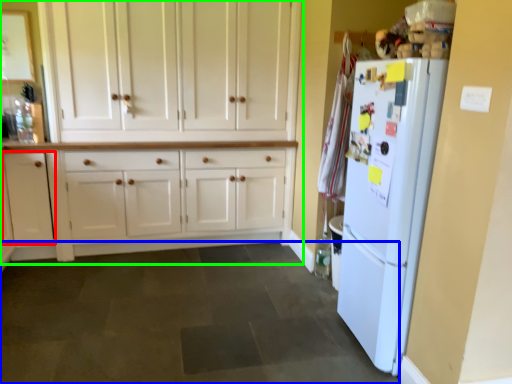
Question: Which object is positioned closest to cabinetry (highlighted by a red box)? Select from plain (highlighted by a blue box) and cabinetry (highlighted by a green box).

Choices:
 (A) plain
 (B) cabinetry

Answer: (B)